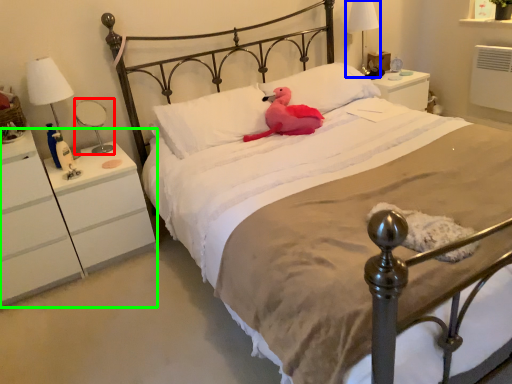
Question: Which object is positioned farthest from bedside lamp (highlighted by a red box)? Select from bedside lamp (highlighted by a blue box) and nightstand (highlighted by a green box).

Choices:
 (A) bedside lamp
 (B) nightstand

Answer: (A)